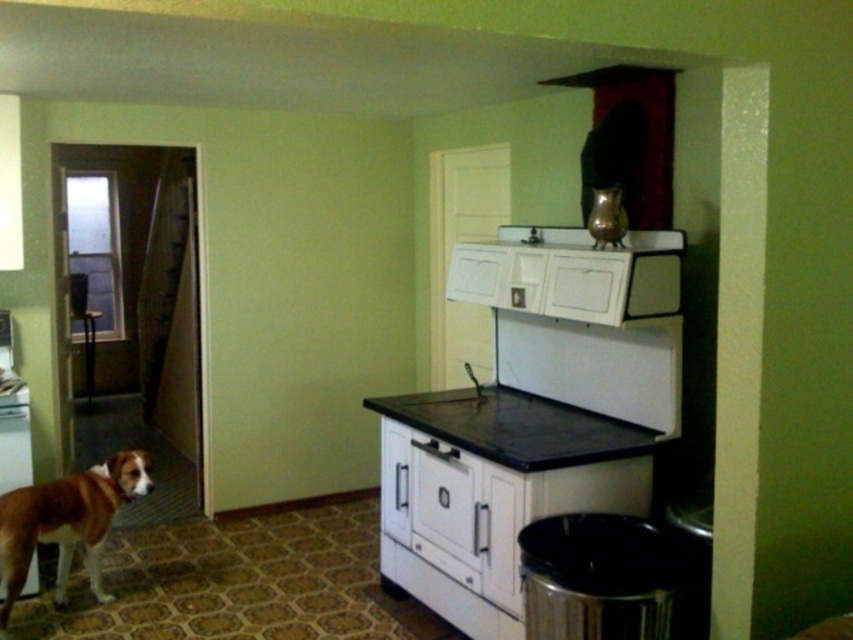
Question: Is brown fur dog at lower left above white matte refrigerator at left?

Choices:
 (A) no
 (B) yes

Answer: (A)

Question: Does black matte countertop at center have a smaller size compared to metallic red exhaust hood at upper center?

Choices:
 (A) no
 (B) yes

Answer: (A)

Question: Is brown fur dog at lower left to the right of white matte refrigerator at left from the viewer's perspective?

Choices:
 (A) yes
 (B) no

Answer: (A)

Question: Which is farther from the metallic red exhaust hood at upper center?

Choices:
 (A) black matte countertop at center
 (B) white matte refrigerator at left
 (C) brown fur dog at lower left

Answer: (B)

Question: Which of these objects is positioned closest to the white matte refrigerator at left?

Choices:
 (A) metallic red exhaust hood at upper center
 (B) black matte countertop at center

Answer: (B)

Question: Which object is closer to the camera taking this photo?

Choices:
 (A) black matte countertop at center
 (B) white matte refrigerator at left
 (C) brown fur dog at lower left
 (D) metallic red exhaust hood at upper center

Answer: (A)